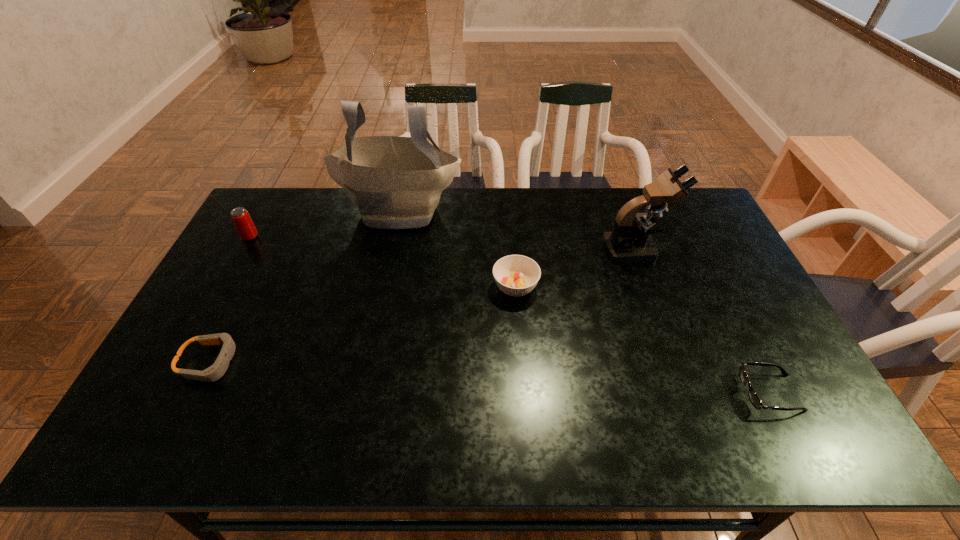
I want to click on goggles present at the left edge, so click(217, 370).

This screenshot has height=540, width=960. What are the coordinates of `object at the right edge` in the screenshot? It's located at (754, 399).

Locate an element on the screen. This screenshot has width=960, height=540. object that is at the near right corner is located at coordinates (754, 399).

You are a GUI agent. You are given a task and a screenshot of the screen. Output one action in this format:
    pyautogui.click(x=<x>, y=<y>)
    Task: Click on the vacant space at the far edge of the desktop
    The image size is (960, 540).
    Given the screenshot: What is the action you would take?
    pyautogui.click(x=609, y=201)

At what (x,y) coordinates should I click in order to perform the action: click on blank area at the left edge. Please return your answer as a coordinate pair (x, y). This screenshot has width=960, height=540. Looking at the image, I should click on (222, 285).

At what (x,y) coordinates should I click in order to perform the action: click on vacant area at the right edge. Please return your answer as a coordinate pair (x, y). Image resolution: width=960 pixels, height=540 pixels. Looking at the image, I should click on (684, 239).

The height and width of the screenshot is (540, 960). I want to click on free space between the goggles and the shopping bag, so click(x=305, y=286).

The image size is (960, 540). Find the location of `free space that is in between the beer can and the rightmost object`. free space that is in between the beer can and the rightmost object is located at coordinates (510, 315).

The image size is (960, 540). Find the location of `vacant space that is in between the farthest object and the second object from right to left`. vacant space that is in between the farthest object and the second object from right to left is located at coordinates (517, 230).

I want to click on vacant space that's between the fourth tallest object and the tallest object, so click(458, 248).